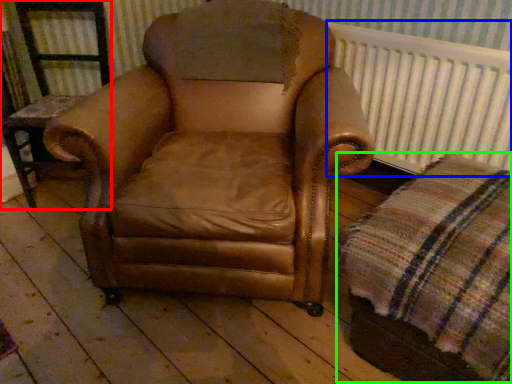
Question: Based on their relative distances, which object is farther from furniture (highlighted by a red box)? Choose from radiator (highlighted by a blue box) and plaid (highlighted by a green box).

Choices:
 (A) radiator
 (B) plaid

Answer: (B)